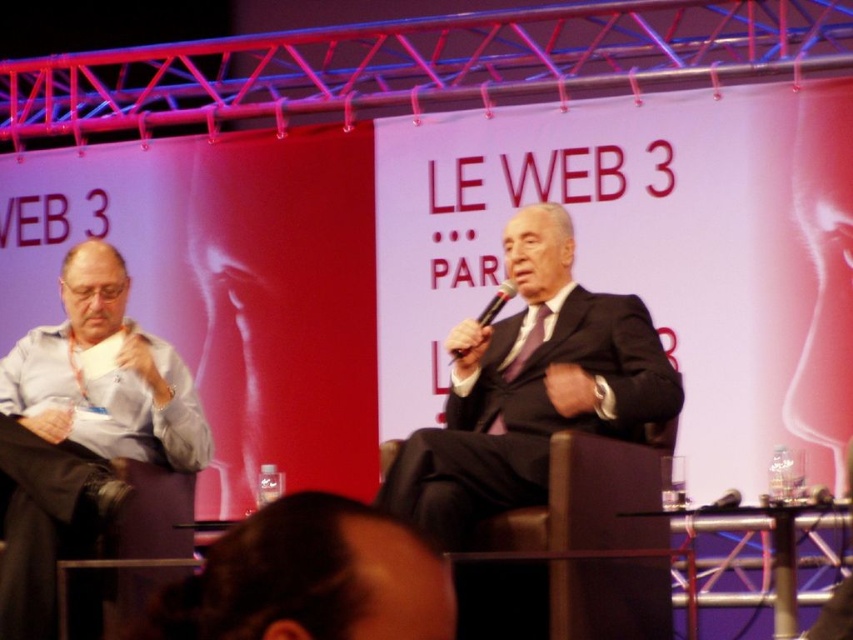
Question: Is blue shirt at left above black plastic microphone at center?

Choices:
 (A) yes
 (B) no

Answer: (B)

Question: Which point appears closest to the camera in this image?

Choices:
 (A) (16, 524)
 (B) (467, 392)
 (C) (509, 285)

Answer: (A)

Question: Which point is closer to the camera?

Choices:
 (A) blue shirt at left
 (B) matte black suit at center
 (C) black plastic microphone at center

Answer: (B)

Question: Which point is closer to the camera taking this photo?

Choices:
 (A) (97, 392)
 (B) (451, 349)
 (C) (606, 317)

Answer: (B)

Question: Is matte black suit at center to the left of black plastic microphone at center from the viewer's perspective?

Choices:
 (A) no
 (B) yes

Answer: (A)

Question: Does blue shirt at left have a larger size compared to black plastic microphone at center?

Choices:
 (A) no
 (B) yes

Answer: (B)